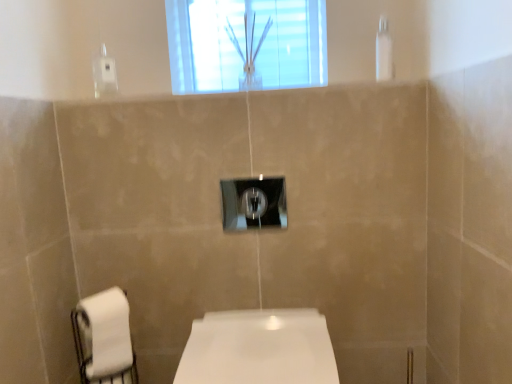
Identify the location of white glossy toilet at center. (258, 348).

In order to click on satin nickel light switch at center in this screenshot , I will do (254, 203).

Locate an element on the screen. The image size is (512, 384). clear glass vase at upper center is located at coordinates (246, 44).

Which is closer, [385,20] or [307,320]?

Point [385,20] appears to be farther away from the viewer than point [307,320].

You are a GUI agent. You are given a task and a screenshot of the screen. Output one action in this format:
    pyautogui.click(x=<x>, y=<y>)
    Task: Click on the shower that appears on the right of white glossy toilet at center
    
    Given the screenshot: What is the action you would take?
    [x=384, y=52]

Locate an element on the screen. The height and width of the screenshot is (384, 512). shower behind the satin nickel light switch at center is located at coordinates (384, 52).

Does point (226, 203) come farther from viewer compared to point (379, 33)?

Yes, point (226, 203) is behind point (379, 33).

From the image's perspective, which one is positioned lower, satin nickel light switch at center or clear plastic shower at upper right?

satin nickel light switch at center appears lower in the image.

Which object is positioned more to the left, white matte toilet paper at lower left or white glossy toilet at center?

Positioned to the left is white matte toilet paper at lower left.

I want to click on toilet paper above the white glossy toilet at center (from a real-world perspective), so click(104, 339).

Between white matte toilet paper at lower left and white glossy toilet at center, which one has smaller width?

With smaller width is white matte toilet paper at lower left.

From a real-world perspective, is white matte toilet paper at lower left over white glossy toilet at center?

Correct, in the physical world, white matte toilet paper at lower left is higher than white glossy toilet at center.

Considering the relative positions of satin nickel light switch at center and clear glass vase at upper center in the image provided, is satin nickel light switch at center to the right of clear glass vase at upper center from the viewer's perspective?

Yes.

Is satin nickel light switch at center facing towards clear glass vase at upper center?

No, satin nickel light switch at center is not facing towards clear glass vase at upper center.

From a real-world perspective, is satin nickel light switch at center physically located above or below clear glass vase at upper center?

satin nickel light switch at center is below clear glass vase at upper center.

Looking at this image, which object is positioned more to the right, white matte toilet paper at lower left or clear plastic shower at upper right?

Positioned to the right is clear plastic shower at upper right.

Is white matte toilet paper at lower left aimed at clear plastic shower at upper right?

No, white matte toilet paper at lower left is not oriented towards clear plastic shower at upper right.

Do you think white matte toilet paper at lower left is within clear plastic shower at upper right, or outside of it?

The correct answer is: outside.

Does point (97, 303) come closer to viewer compared to point (385, 23)?

Yes.

Considering the positions of point (378, 79) and point (233, 222), is point (378, 79) closer or farther from the camera than point (233, 222)?

Point (378, 79) appears to be closer to the viewer than point (233, 222).

Is clear plastic shower at upper right in front of satin nickel light switch at center?

No, clear plastic shower at upper right is further to the viewer.

Is clear plastic shower at upper right facing towards satin nickel light switch at center?

No, clear plastic shower at upper right is not facing towards satin nickel light switch at center.

From the image's perspective, is clear plastic shower at upper right located above or below satin nickel light switch at center?

clear plastic shower at upper right is situated higher than satin nickel light switch at center in the image.

Choose the correct answer: Is clear glass vase at upper center inside satin nickel light switch at center or outside it?

clear glass vase at upper center is spatially situated outside satin nickel light switch at center.

Which object is further away from the camera taking this photo, clear glass vase at upper center or satin nickel light switch at center?

clear glass vase at upper center is more distant.

Find the location of a particular element. The width and height of the screenshot is (512, 384). light switch below the clear glass vase at upper center (from the image's perspective) is located at coordinates (254, 203).

Where is `shower that is behind the white glossy toilet at center`? Image resolution: width=512 pixels, height=384 pixels. shower that is behind the white glossy toilet at center is located at coordinates (384, 52).

Locate an element on the screen. This screenshot has height=384, width=512. light switch lying below the clear plastic shower at upper right (from the image's perspective) is located at coordinates (254, 203).

From the image, which object appears to be farther from white glossy toilet at center, satin nickel light switch at center or clear plastic shower at upper right?

clear plastic shower at upper right is further to white glossy toilet at center.

Looking at the image, which one is located further to clear glass vase at upper center, white glossy toilet at center or clear plastic shower at upper right?

white glossy toilet at center lies further to clear glass vase at upper center than the other object.

Looking at the image, which one is located further to white glossy toilet at center, clear plastic shower at upper right or satin nickel light switch at center?

The object further to white glossy toilet at center is clear plastic shower at upper right.

Which object lies further to the anchor point clear plastic shower at upper right, satin nickel light switch at center or white glossy toilet at center?

The object further to clear plastic shower at upper right is white glossy toilet at center.

Which object lies further to the anchor point satin nickel light switch at center, white matte toilet paper at lower left or clear glass vase at upper center?

clear glass vase at upper center.

Estimate the real-world distances between objects in this image. Which object is closer to clear plastic shower at upper right, satin nickel light switch at center or white matte toilet paper at lower left?

The object closer to clear plastic shower at upper right is satin nickel light switch at center.

Considering their positions, is clear glass vase at upper center positioned further to clear plastic shower at upper right than white glossy toilet at center?

white glossy toilet at center is positioned further to the anchor clear plastic shower at upper right.

Which object lies nearer to the anchor point clear plastic shower at upper right, clear glass vase at upper center or white matte toilet paper at lower left?

Based on the image, clear glass vase at upper center appears to be nearer to clear plastic shower at upper right.

At what (x,y) coordinates should I click in order to perform the action: click on light switch between clear plastic shower at upper right and white glossy toilet at center in the up-down direction. Please return your answer as a coordinate pair (x, y). The image size is (512, 384). Looking at the image, I should click on (254, 203).

You are a GUI agent. You are given a task and a screenshot of the screen. Output one action in this format:
    pyautogui.click(x=<x>, y=<y>)
    Task: Click on the light switch between white matte toilet paper at lower left and white glossy toilet at center
    Image resolution: width=512 pixels, height=384 pixels.
    Given the screenshot: What is the action you would take?
    pyautogui.click(x=254, y=203)

Find the location of a particular element. Image resolution: width=512 pixels, height=384 pixels. shower that lies between clear glass vase at upper center and white matte toilet paper at lower left from top to bottom is located at coordinates (x=384, y=52).

The width and height of the screenshot is (512, 384). Identify the location of light switch between clear plastic shower at upper right and white matte toilet paper at lower left vertically. [x=254, y=203].